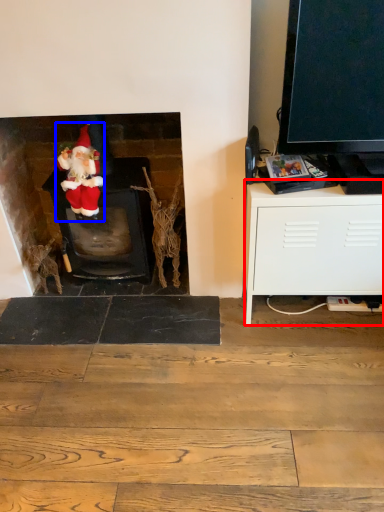
Question: Which point is closer to the camera, cabinetry (highlighted by a red box) or person (highlighted by a blue box)?

Choices:
 (A) cabinetry
 (B) person

Answer: (A)